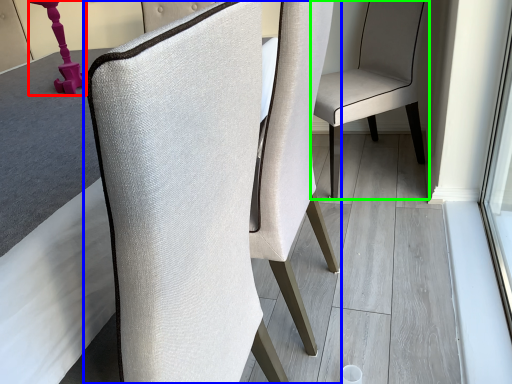
Question: Based on their relative distances, which object is farther from table lamp (highlighted by a red box)? Choose from chair (highlighted by a blue box) and chair (highlighted by a green box).

Choices:
 (A) chair
 (B) chair

Answer: (B)